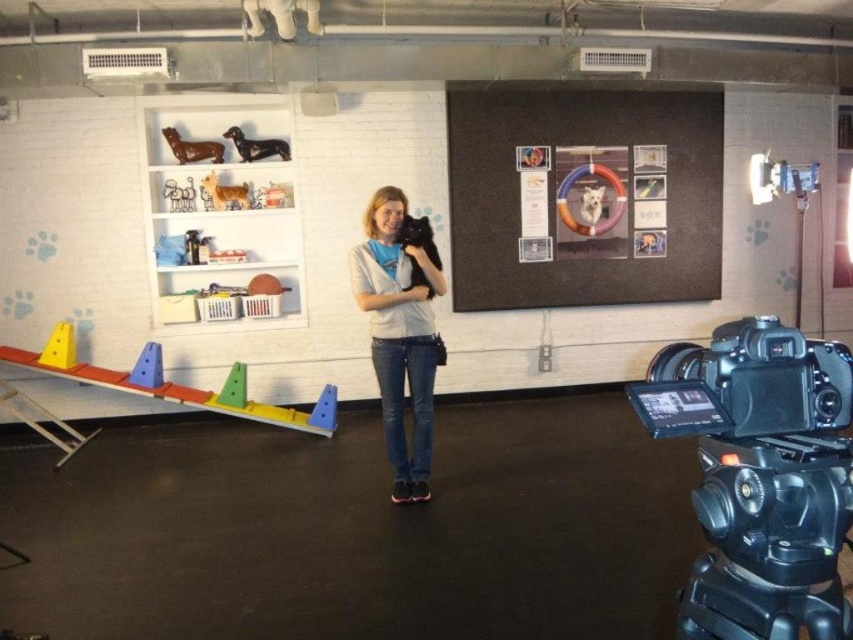
Does black plastic video camera at lower right have a smaller size compared to black plastic tripod at lower right?

No.

Is black plastic video camera at lower right bigger than black plastic tripod at lower right?

Yes, black plastic video camera at lower right is bigger than black plastic tripod at lower right.

Is point (711, 346) positioned after point (740, 572)?

Yes.

Locate an element on the screen. black plastic video camera at lower right is located at coordinates (759, 476).

Is white matte bookshelf at upper left thinner than denim jeans at center?

No, white matte bookshelf at upper left is not thinner than denim jeans at center.

Locate an element on the screen. This screenshot has width=853, height=640. white matte bookshelf at upper left is located at coordinates (219, 205).

This screenshot has width=853, height=640. I want to click on white matte bookshelf at upper left, so pos(219,205).

Between black plastic video camera at lower right and white matte bookshelf at upper left, which one has more height?

Standing taller between the two is white matte bookshelf at upper left.

At what (x,y) coordinates should I click in order to perform the action: click on black plastic video camera at lower right. Please return your answer as a coordinate pair (x, y). The width and height of the screenshot is (853, 640). Looking at the image, I should click on (759, 476).

Image resolution: width=853 pixels, height=640 pixels. What do you see at coordinates (759, 476) in the screenshot? I see `black plastic video camera at lower right` at bounding box center [759, 476].

Find the location of `black plastic video camera at lower right`. black plastic video camera at lower right is located at coordinates (759, 476).